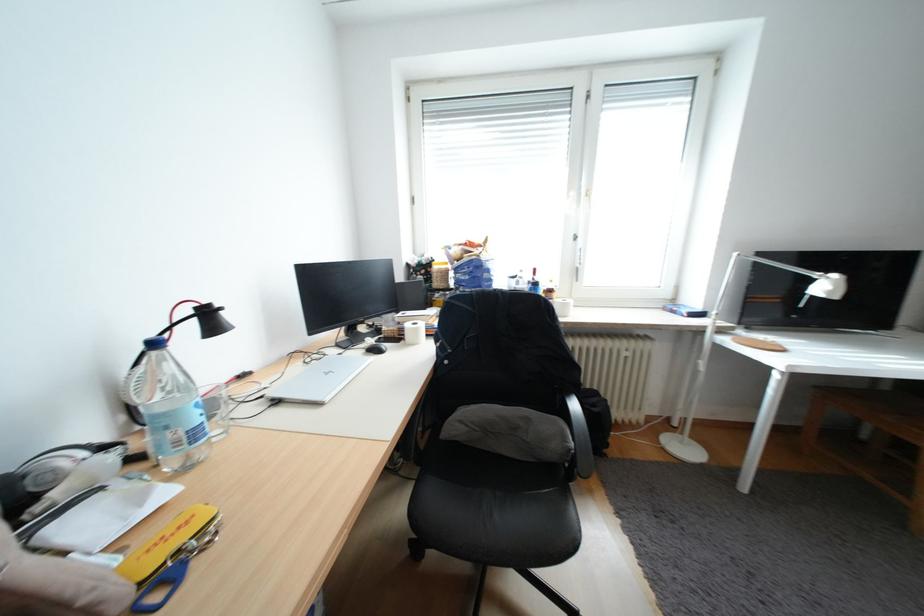
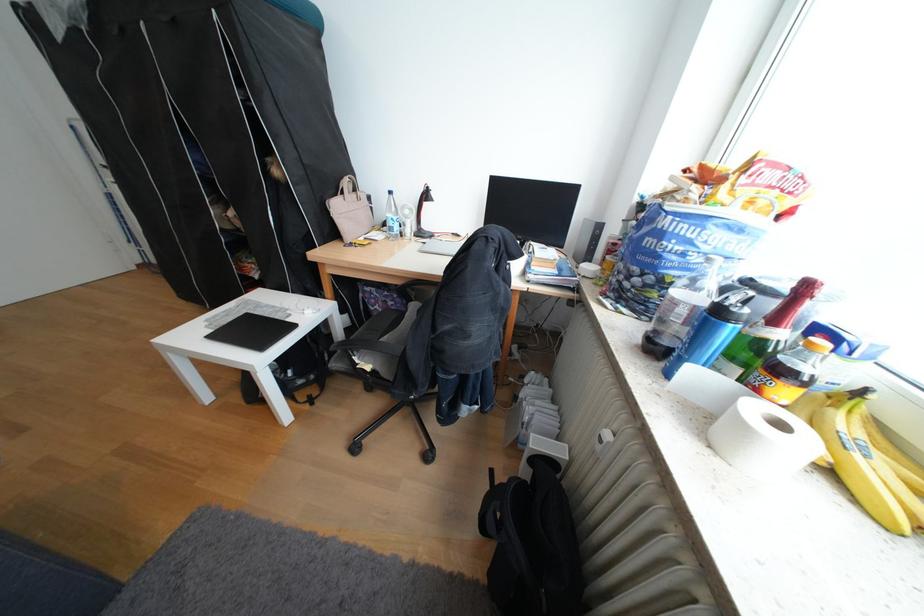
Locate, in the second image, the point that corresponds to (x=546, y=272) in the first image.

(819, 288)